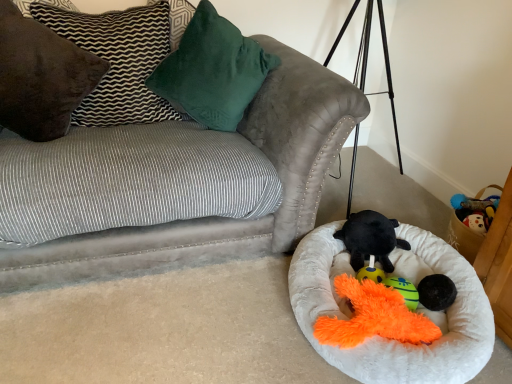
Question: From the image's perspective, would you say velvety green pillow at upper center, which ranks as the 1th pillow in right-to-left order, is positioned over velvet gray couch at upper left?

Choices:
 (A) yes
 (B) no

Answer: (A)

Question: Is velvety green pillow at upper center, acting as the 3th pillow starting from the left, positioned in front of velvet gray couch at upper left?

Choices:
 (A) no
 (B) yes

Answer: (A)

Question: Is velvety green pillow at upper center, which ranks as the 1th pillow in right-to-left order, not inside velvet gray couch at upper left?

Choices:
 (A) yes
 (B) no

Answer: (B)

Question: Can you confirm if velvety green pillow at upper center, acting as the 3th pillow starting from the left, is smaller than velvet gray couch at upper left?

Choices:
 (A) no
 (B) yes

Answer: (B)

Question: Is velvety green pillow at upper center, acting as the 3th pillow starting from the left, thinner than velvet gray couch at upper left?

Choices:
 (A) no
 (B) yes

Answer: (B)

Question: Considering the positions of brown suede pillow at upper left, which is counted as the second pillow, starting from the left, and velvet gray couch at upper left in the image, is brown suede pillow at upper left, which is counted as the second pillow, starting from the left, wider or thinner than velvet gray couch at upper left?

Choices:
 (A) thin
 (B) wide

Answer: (A)

Question: Is point (139, 36) positioned closer to the camera than point (289, 66)?

Choices:
 (A) closer
 (B) farther

Answer: (A)

Question: Is brown suede pillow at upper left, which appears as the second pillow when viewed from the right, inside or outside of velvet gray couch at upper left?

Choices:
 (A) inside
 (B) outside

Answer: (A)

Question: In the image, is brown suede pillow at upper left, which appears as the second pillow when viewed from the right, on the left side or the right side of velvet gray couch at upper left?

Choices:
 (A) right
 (B) left

Answer: (B)

Question: Visually, is teal plush toy at lower center positioned to the left or to the right of white fluffy dog bed at lower right?

Choices:
 (A) right
 (B) left

Answer: (A)

Question: Is teal plush toy at lower center spatially inside white fluffy dog bed at lower right, or outside of it?

Choices:
 (A) inside
 (B) outside

Answer: (A)

Question: Is point (408, 291) positioned closer to the camera than point (409, 362)?

Choices:
 (A) closer
 (B) farther

Answer: (B)

Question: Is teal plush toy at lower center taller or shorter than white fluffy dog bed at lower right?

Choices:
 (A) short
 (B) tall

Answer: (A)

Question: Considering the positions of velvet gray couch at upper left and brown suede pillow at upper left, which appears as the second pillow when viewed from the right, in the image, is velvet gray couch at upper left taller or shorter than brown suede pillow at upper left, which appears as the second pillow when viewed from the right,?

Choices:
 (A) short
 (B) tall

Answer: (B)

Question: From a real-world perspective, is velvet gray couch at upper left physically located above or below brown suede pillow at upper left, which appears as the second pillow when viewed from the right?

Choices:
 (A) above
 (B) below

Answer: (B)